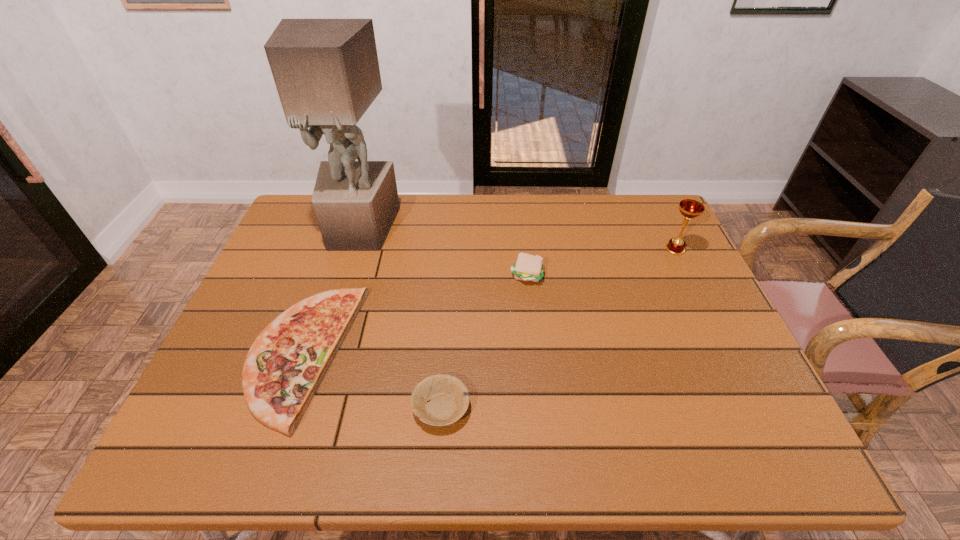
At what (x,y) coordinates should I click in order to perform the action: click on free area in between the chalice and the third object from right to left. Please return your answer as a coordinate pair (x, y). The width and height of the screenshot is (960, 540). Looking at the image, I should click on (558, 329).

Locate an element on the screen. vacant area that lies between the bowl and the sculpture is located at coordinates (400, 319).

Locate an element on the screen. This screenshot has height=540, width=960. free point between the tallest object and the second object from right to left is located at coordinates (444, 252).

This screenshot has width=960, height=540. What are the coordinates of `free spot between the bowl and the sculpture` in the screenshot? It's located at (400, 319).

The width and height of the screenshot is (960, 540). In order to click on free space between the patty and the rightmost object in this screenshot , I will do `click(601, 262)`.

Locate an element on the screen. free space between the shortest object and the rightmost object is located at coordinates (558, 329).

Identify the location of free point between the sculpture and the patty. The image size is (960, 540). (444, 252).

Choose which object is the third nearest neighbor to the second object from right to left. Please provide its 2D coordinates. Your answer should be formatted as a tuple, i.e. [(x, y)], where the tuple contains the x and y coordinates of a point satisfying the conditions above.

[(689, 208)]

Where is `object identified as the second closest to the fourth object from left to right`? The height and width of the screenshot is (540, 960). object identified as the second closest to the fourth object from left to right is located at coordinates (326, 71).

The height and width of the screenshot is (540, 960). In order to click on vacant position in the image that satisfies the following two spatial constraints: 1. on the back side of the third nearest object; 2. on the left side of the pizza in this screenshot , I will do 330,275.